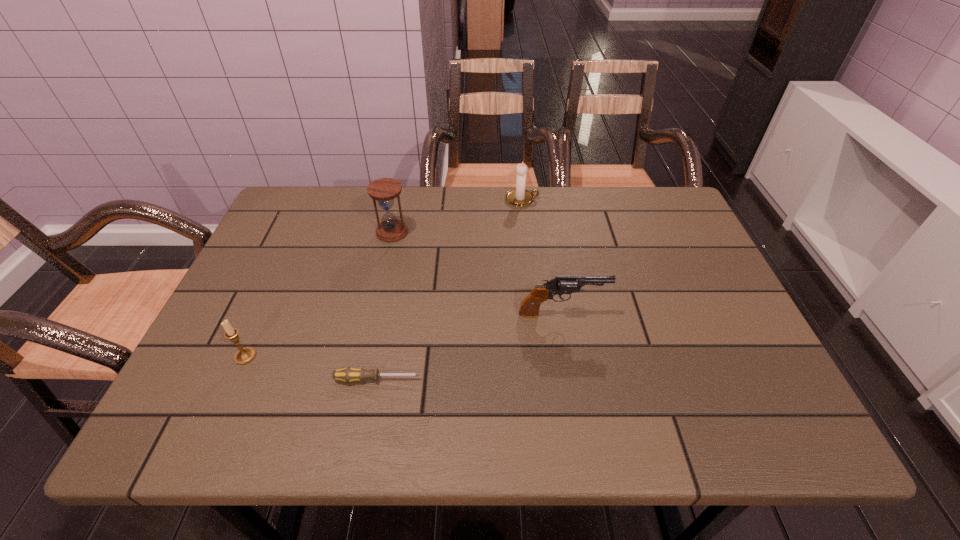
The height and width of the screenshot is (540, 960). I want to click on free region located 0.100m along the barrel of the gun, so (x=648, y=313).

Locate an element on the screen. free space located 0.330m on the right of the left candle holder is located at coordinates (409, 356).

At what (x,y) coordinates should I click in order to perform the action: click on vacant space located 0.170m at the tip of the shortest object. Please return your answer as a coordinate pair (x, y). Looking at the image, I should click on (504, 379).

Find the location of `hourglass that is at the far edge`. hourglass that is at the far edge is located at coordinates (384, 190).

The height and width of the screenshot is (540, 960). Find the location of `candle holder situated at the far edge`. candle holder situated at the far edge is located at coordinates (520, 196).

The image size is (960, 540). Identify the location of object that is at the left edge. (245, 355).

At what (x,y) coordinates should I click in order to perform the action: click on vacant space at the far edge. Please return your answer as a coordinate pair (x, y). The image size is (960, 540). Looking at the image, I should click on click(488, 228).

This screenshot has width=960, height=540. What are the coordinates of `free space at the near edge of the desktop` in the screenshot? It's located at (441, 421).

This screenshot has height=540, width=960. Find the location of `free space at the left edge`. free space at the left edge is located at coordinates (250, 368).

In the image, there is a desktop. Where is `blank space at the right edge`? The height and width of the screenshot is (540, 960). blank space at the right edge is located at coordinates (656, 252).